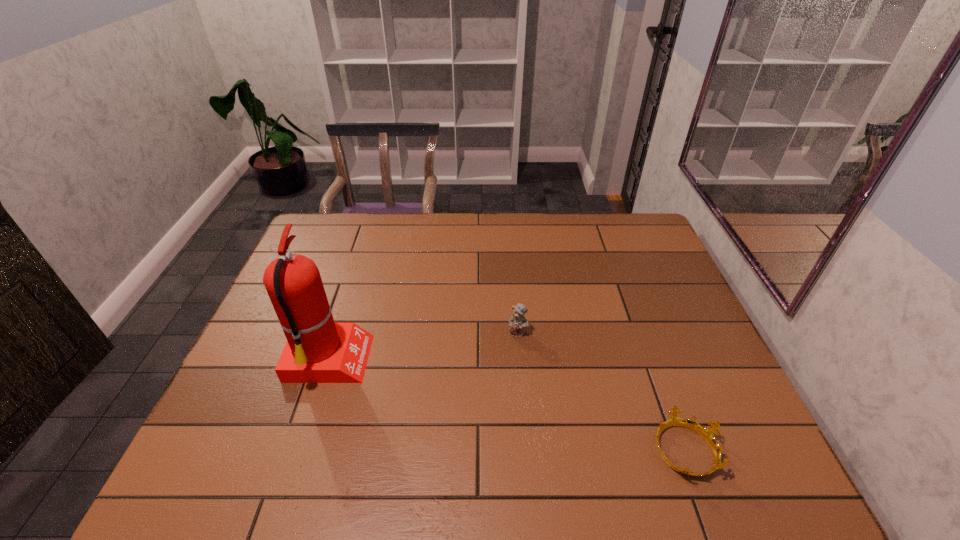
The image size is (960, 540). Identify the location of object that can be found as the closest to the nearest object. point(517,322).

This screenshot has width=960, height=540. I want to click on the closest object to the crown, so click(517, 322).

What are the coordinates of `vacant position in the image that satisfies the following two spatial constraints: 1. on the front-facing side of the second object from right to left; 2. on the front-facing side of the tallest object` in the screenshot? It's located at (520, 362).

The image size is (960, 540). Find the location of `blank space that satisfies the following two spatial constraints: 1. on the back side of the crown; 2. on the front-facing side of the tallest object`. blank space that satisfies the following two spatial constraints: 1. on the back side of the crown; 2. on the front-facing side of the tallest object is located at coordinates (652, 362).

Find the location of a particular element. free spot that satisfies the following two spatial constraints: 1. on the front-facing side of the nearest object; 2. on the left side of the fire extinguisher is located at coordinates (300, 449).

At what (x,y) coordinates should I click in order to perform the action: click on free spot that satisfies the following two spatial constraints: 1. on the front-facing side of the second object from left to right; 2. on the front-facing side of the tallest object. Please return your answer as a coordinate pair (x, y). The width and height of the screenshot is (960, 540). Looking at the image, I should click on (520, 362).

This screenshot has width=960, height=540. I want to click on vacant space that satisfies the following two spatial constraints: 1. on the front-facing side of the teddy bear; 2. on the front-facing side of the fire extinguisher, so click(x=520, y=362).

You are a GUI agent. You are given a task and a screenshot of the screen. Output one action in this format:
    pyautogui.click(x=<x>, y=<y>)
    Task: Click on the vacant position in the image that satisfies the following two spatial constraints: 1. on the front-facing side of the teddy bear; 2. on the right side of the rightmost object
    This screenshot has width=960, height=540.
    Given the screenshot: What is the action you would take?
    pyautogui.click(x=528, y=449)

The width and height of the screenshot is (960, 540). Identify the location of blank area in the image that satisfies the following two spatial constraints: 1. on the front-facing side of the fire extinguisher; 2. on the back side of the nearest object. (300, 449).

Locate an element on the screen. The width and height of the screenshot is (960, 540). vacant area that satisfies the following two spatial constraints: 1. on the back side of the rightmost object; 2. on the front-facing side of the fire extinguisher is located at coordinates pyautogui.click(x=652, y=362).